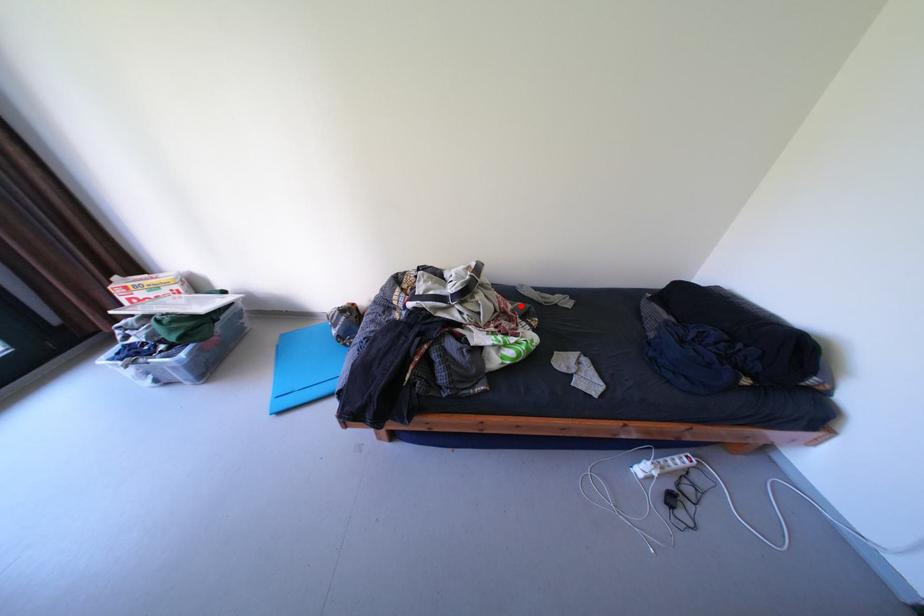
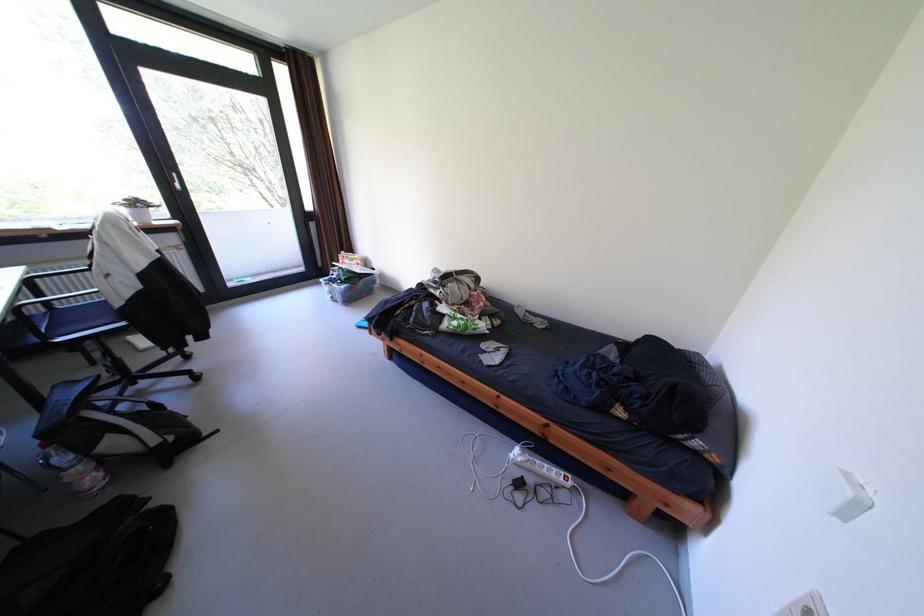
Where in the second image is the point corresponding to the highlighted location from the first image?

(492, 304)